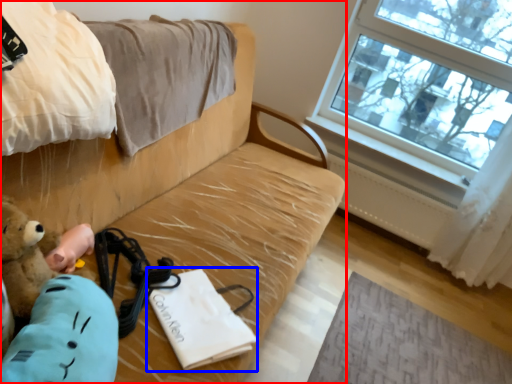
Question: Among these objects, which one is farthest to the camera, studio couch (highlighted by a red box) or journal (highlighted by a blue box)?

Choices:
 (A) studio couch
 (B) journal

Answer: (B)